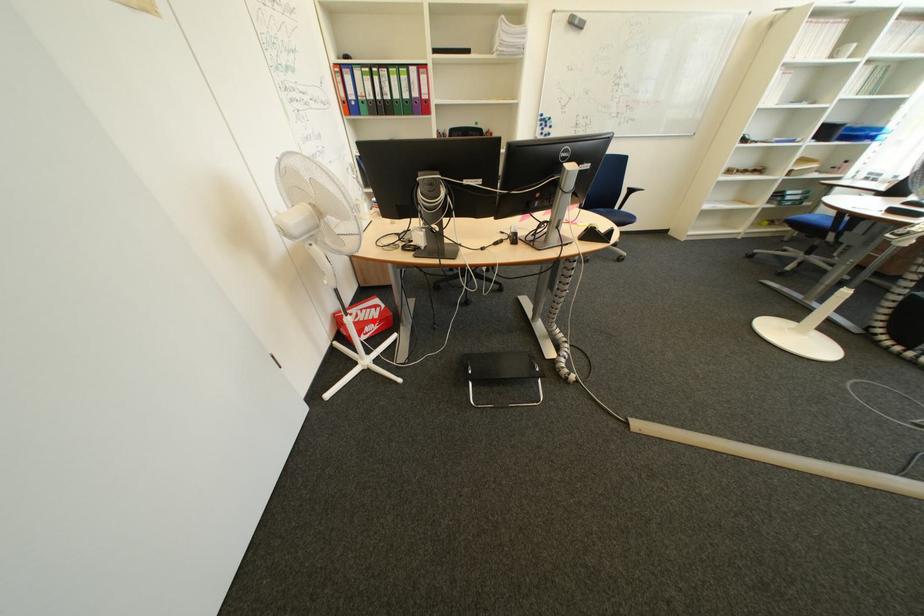
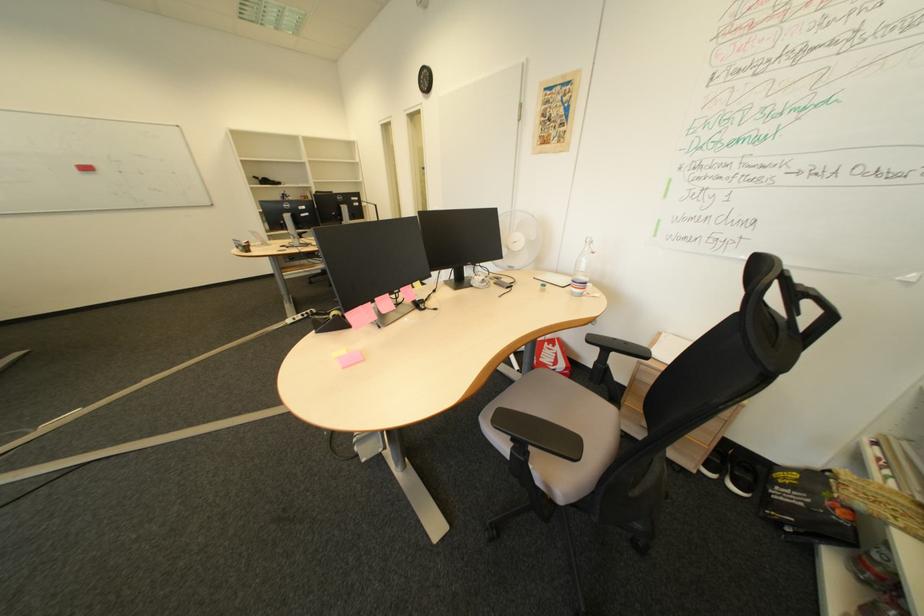
Question: A red point is marked in image1. In image2, is the corresponding 3D point closer to the camera or farther? Reply with the corresponding letter.

Choices:
 (A) The corresponding 3D point is closer.
 (B) The corresponding 3D point is farther.

Answer: (B)